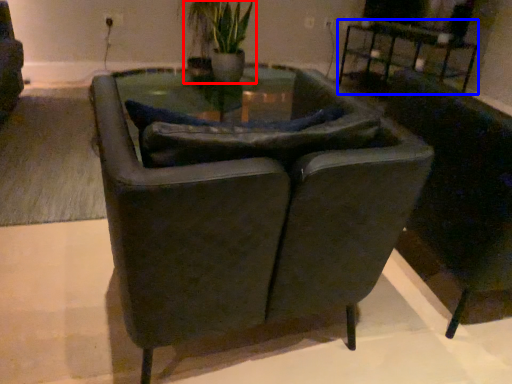
Question: Among these objects, which one is farthest to the camera, houseplant (highlighted by a red box) or table (highlighted by a blue box)?

Choices:
 (A) houseplant
 (B) table

Answer: (A)